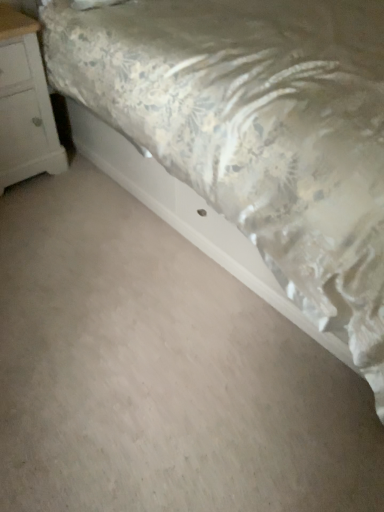
The width and height of the screenshot is (384, 512). Describe the element at coordinates (25, 104) in the screenshot. I see `white painted wood nightstand at left` at that location.

The image size is (384, 512). Identify the location of white painted wood nightstand at left. (25, 104).

The width and height of the screenshot is (384, 512). Identify the location of white painted wood nightstand at left. (25, 104).